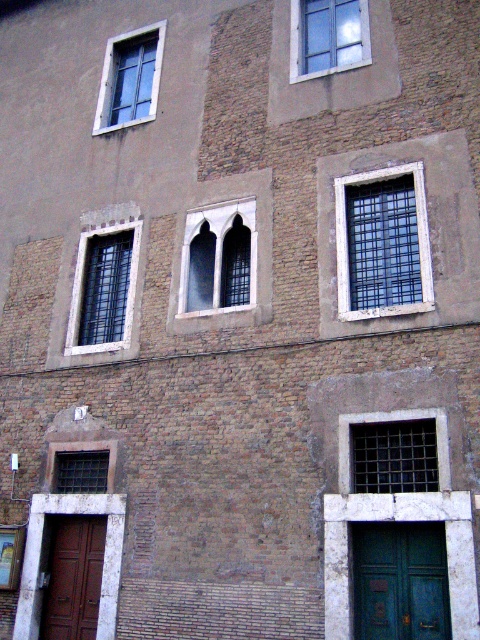
You are a delivery person standing at the teal matte door at lower right and need to reach the matte black window at lower left to deliver a package. Can you walk directly to the window without going around the building?

The teal matte door at lower right and the matte black window at lower left are 5.64 meters apart from each other. Since they are on the same side of the building, you can walk directly to the window without needing to go around the building.

Based on the scene description, which object is located at the coordinates point (327, 36)?

The point (327, 36) marks the clear glass window at upper center.

Consider the image. You are a delivery person trying to enter the building through the teal matte door at lower right. You notice there is a matte black window at lower left nearby. Which one is taller?

The teal matte door at lower right is taller than the matte black window at lower left according to the description.